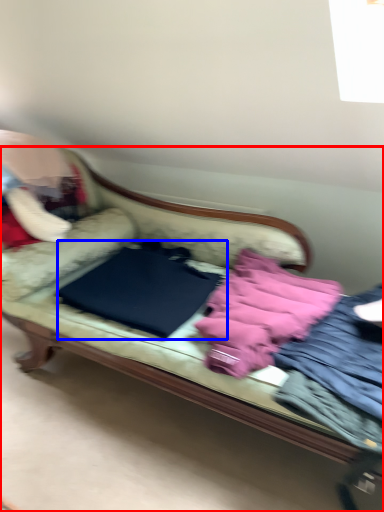
Question: Which point is closer to the camera, studio couch (highlighted by a red box) or sheet (highlighted by a blue box)?

Choices:
 (A) studio couch
 (B) sheet

Answer: (A)